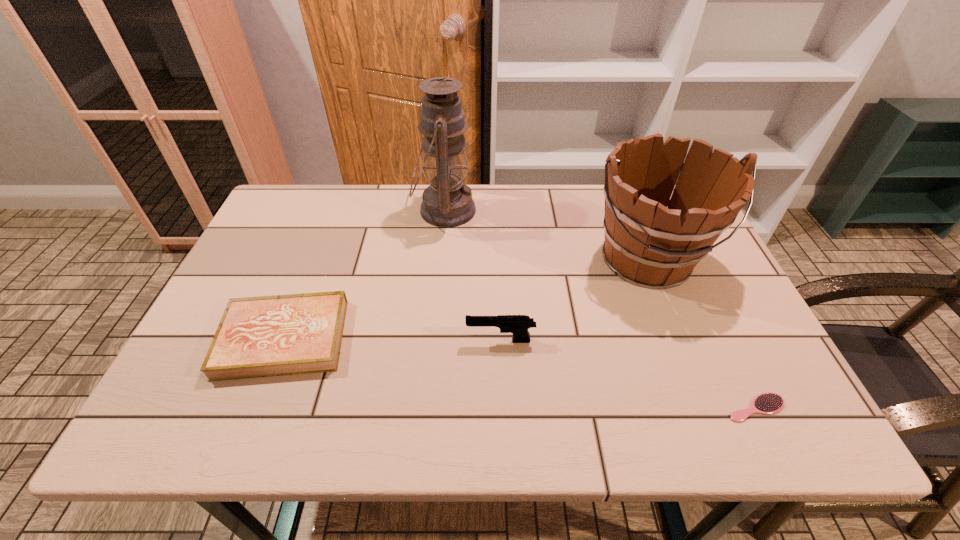
At what (x,y) coordinates should I click in order to perform the action: click on object located in the far right corner section of the desktop. Please return your answer as a coordinate pair (x, y). Looking at the image, I should click on (650, 245).

The image size is (960, 540). Find the location of `object that is positioned at the near right corner`. object that is positioned at the near right corner is located at coordinates (767, 403).

Image resolution: width=960 pixels, height=540 pixels. I want to click on blank space at the far edge of the desktop, so [x=414, y=200].

You are a GUI agent. You are given a task and a screenshot of the screen. Output one action in this format:
    pyautogui.click(x=<x>, y=<y>)
    Task: Click on the vacant position at the near edge of the desktop
    This screenshot has width=960, height=540.
    Given the screenshot: What is the action you would take?
    pyautogui.click(x=263, y=424)

Find the location of `blank space at the left edge of the desktop`. blank space at the left edge of the desktop is located at coordinates (308, 233).

Locate an element on the screen. vacant space at the right edge is located at coordinates (727, 366).

The width and height of the screenshot is (960, 540). Find the location of `vacant position at the near left corner of the desktop`. vacant position at the near left corner of the desktop is located at coordinates (236, 416).

Where is `free area in between the tallest object and the nearest object`? free area in between the tallest object and the nearest object is located at coordinates (600, 309).

At what (x,y) coordinates should I click in order to perform the action: click on free spot between the third tallest object and the hairbrush. Please return your answer as a coordinate pair (x, y). Looking at the image, I should click on (628, 374).

I want to click on free point between the shortest object and the fourth shortest object, so click(x=701, y=334).